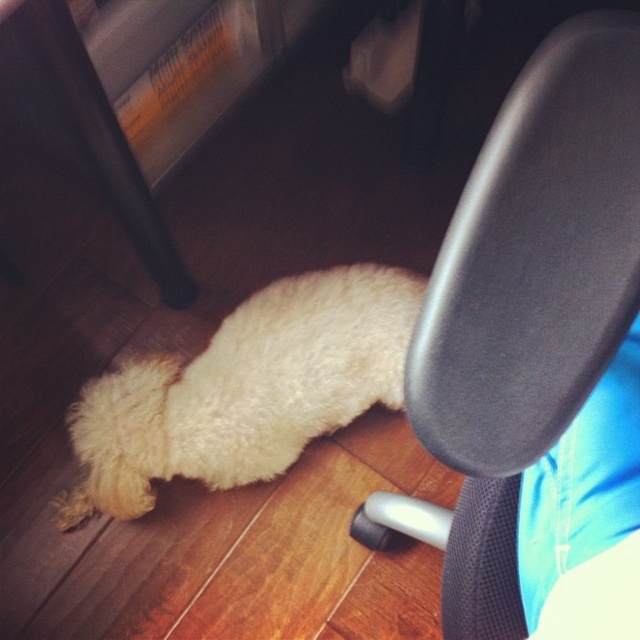
Question: Which object is closer to the camera taking this photo?

Choices:
 (A) black mesh chair at center
 (B) white fluffy dog at lower left

Answer: (A)

Question: Observing the image, what is the correct spatial positioning of black mesh chair at center in reference to white fluffy dog at lower left?

Choices:
 (A) above
 (B) below

Answer: (B)

Question: Can you confirm if black mesh chair at center is smaller than white fluffy dog at lower left?

Choices:
 (A) yes
 (B) no

Answer: (A)

Question: Is black mesh chair at center to the left of white fluffy dog at lower left from the viewer's perspective?

Choices:
 (A) yes
 (B) no

Answer: (B)